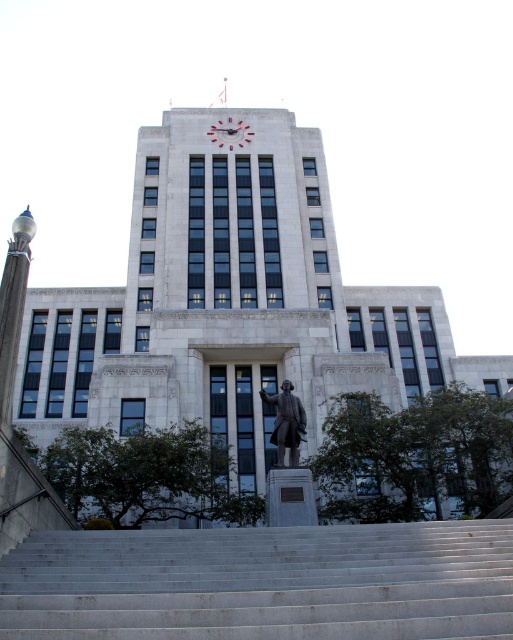
Question: Which point is closer to the camera?

Choices:
 (A) (422, 556)
 (B) (279, 458)

Answer: (A)

Question: Among these objects, which one is farthest from the camera?

Choices:
 (A) white marble stairs at lower center
 (B) bronze statue at center

Answer: (B)

Question: Does white marble stairs at lower center come in front of bronze statue at center?

Choices:
 (A) no
 (B) yes

Answer: (B)

Question: Can you confirm if white marble stairs at lower center is positioned to the left of bronze statue at center?

Choices:
 (A) yes
 (B) no

Answer: (A)

Question: Does white marble stairs at lower center appear on the left side of bronze statue at center?

Choices:
 (A) yes
 (B) no

Answer: (A)